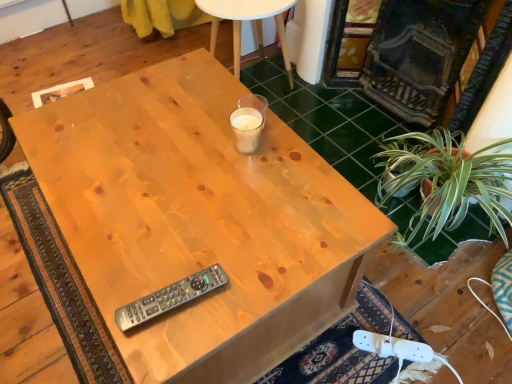
The height and width of the screenshot is (384, 512). I want to click on free location to the left of white paper cup at center, the 2th coffee cup in the bottom-to-top sequence, so click(192, 118).